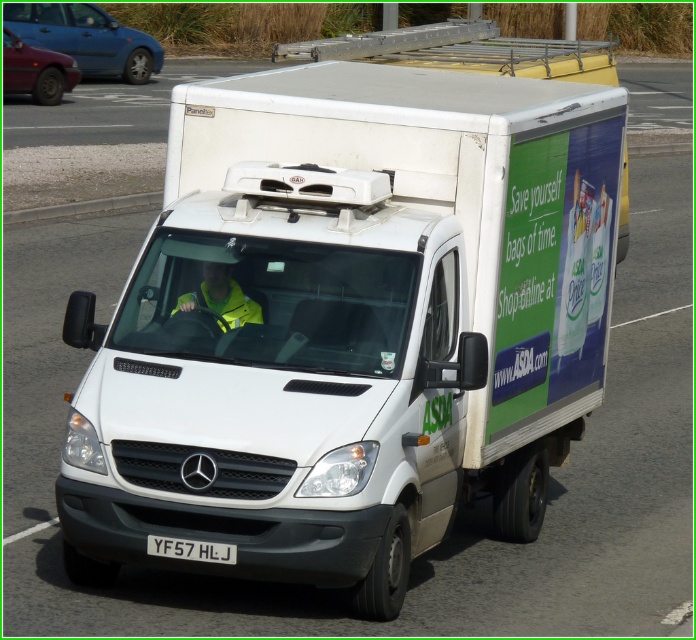
Question: Which object is positioned closest to the blue metallic car at left?

Choices:
 (A) yellow reflective jacket at center
 (B) metallic blue sedan at left

Answer: (B)

Question: Is the position of metallic blue sedan at left less distant than that of white plastic license plate at lower center?

Choices:
 (A) yes
 (B) no

Answer: (B)

Question: Which of the following is the farthest from the observer?

Choices:
 (A) blue metallic car at left
 (B) yellow reflective jacket at center

Answer: (A)

Question: From the image, what is the correct spatial relationship of blue metallic car at left in relation to metallic blue sedan at left?

Choices:
 (A) right
 (B) left

Answer: (A)

Question: Observing the image, what is the correct spatial positioning of metallic blue sedan at left in reference to yellow reflective jacket at center?

Choices:
 (A) right
 (B) left

Answer: (B)

Question: Which is farther from the white plastic license plate at lower center?

Choices:
 (A) blue metallic car at left
 (B) metallic blue sedan at left
 (C) yellow reflective jacket at center

Answer: (A)